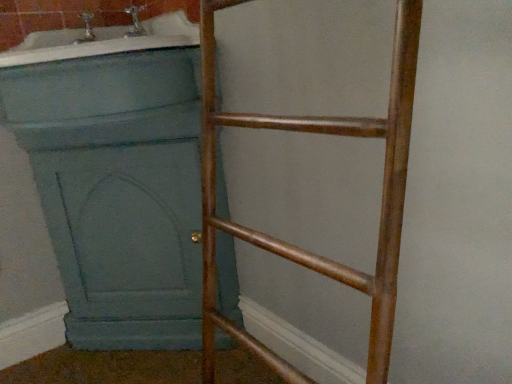
Question: Is bronze metallic ladder at right to the left or to the right of teal painted wood screen door at left in the image?

Choices:
 (A) right
 (B) left

Answer: (A)

Question: From the image's perspective, is bronze metallic ladder at right positioned above or below teal painted wood screen door at left?

Choices:
 (A) below
 (B) above

Answer: (A)

Question: Estimate the real-world distances between objects in this image. Which object is closer to the matte blue bathtub at upper left?

Choices:
 (A) teal painted wood screen door at left
 (B) bronze metallic ladder at right

Answer: (B)

Question: Estimate the real-world distances between objects in this image. Which object is farther from the bronze metallic ladder at right?

Choices:
 (A) matte blue bathtub at upper left
 (B) teal painted wood screen door at left

Answer: (B)